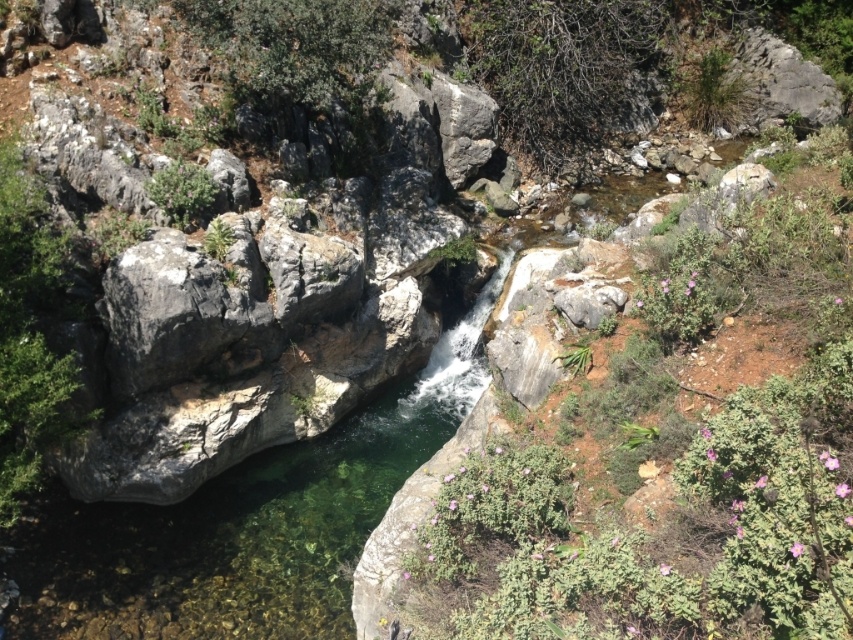
You are a botanist studying plant growth in rocky environments. You observe the green leafy shrubs at center and the gray rough rock at center. Which object occupies a smaller horizontal space in the scene?

The green leafy shrubs at center has a lesser width compared to the gray rough rock at center, so the green leafy shrubs at center occupies a smaller horizontal space.

You are standing at the edge of the pool and want to reach the green leafy shrubs at center. Based on their position, which direction should you walk to get there?

The green leafy shrubs at center are located at coordinates approximately 0.706 on the x and 0.782 on the y axis. Since you are at the edge of the pool, which is at the bottom of the waterfall, you would need to walk towards the center of the scene to reach them.

You are a hiker who wants to cross the pool at the bottom of the waterfall. You see the green leafy shrubs at center and the gray rough rock at center. Which object should you avoid stepping on to stay on solid ground?

You should avoid stepping on the green leafy shrubs at center because they are plants and not solid ground. The gray rough rock at center is solid ground and safer to step on.